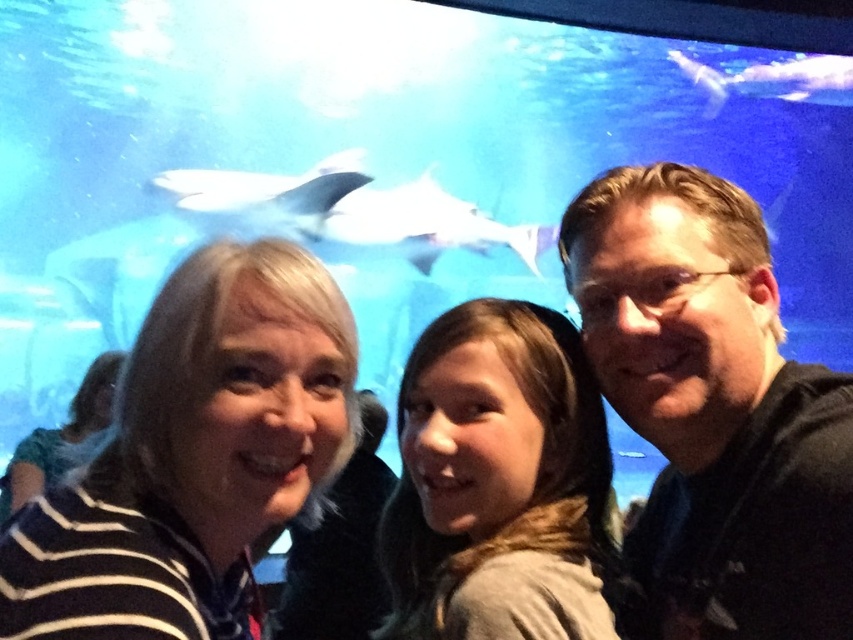
How far apart are white matte shark at upper center and white glossy shark at upper center?

white matte shark at upper center is 7.93 feet away from white glossy shark at upper center.

Is point (325, 256) behind point (747, 67)?

No, it is in front of (747, 67).

I want to click on white matte shark at upper center, so click(354, 211).

Is the position of striped fabric face at left more distant than that of striped fabric at left?

No, it is not.

Does striped fabric face at left have a lesser width compared to striped fabric at left?

Indeed, striped fabric face at left has a lesser width compared to striped fabric at left.

Is point (244, 564) positioned behind point (44, 483)?

No, it is not.

Locate an element on the screen. striped fabric face at left is located at coordinates (193, 456).

Does black matte shirt at right have a smaller size compared to striped fabric at left?

Indeed, black matte shirt at right has a smaller size compared to striped fabric at left.

Is black matte shirt at right behind striped fabric at left?

No, black matte shirt at right is in front of striped fabric at left.

Between point (775, 563) and point (15, 502), which one is positioned in front?

Point (775, 563) is in front.

Identify the location of black matte shirt at right. (714, 408).